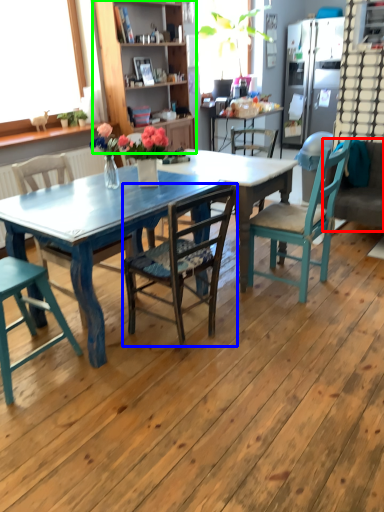
Question: Which object is the farthest from couch (highlighted by a red box)? Choose among these: chair (highlighted by a blue box) or cabinetry (highlighted by a green box).

Choices:
 (A) chair
 (B) cabinetry

Answer: (B)